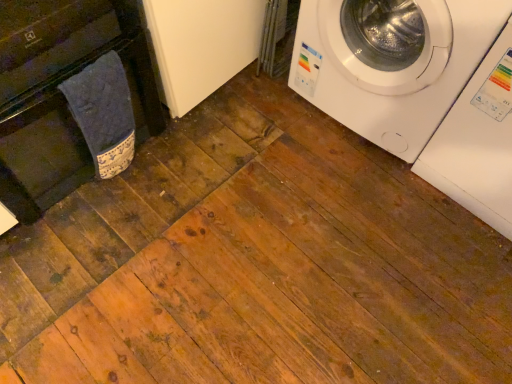
Question: Can you confirm if white glossy washing machine at upper right, the 1th washing machine viewed from the right, is taller than black matte dishwasher at left?

Choices:
 (A) no
 (B) yes

Answer: (A)

Question: Is white glossy washing machine at upper right, the 2th washing machine viewed from the left, shorter than black matte dishwasher at left?

Choices:
 (A) no
 (B) yes

Answer: (B)

Question: Considering the relative positions of white glossy washing machine at upper right, the 2th washing machine viewed from the left, and black matte dishwasher at left in the image provided, is white glossy washing machine at upper right, the 2th washing machine viewed from the left, to the left of black matte dishwasher at left from the viewer's perspective?

Choices:
 (A) no
 (B) yes

Answer: (A)

Question: Is black matte dishwasher at left at the back of white glossy washing machine at upper right, the 1th washing machine viewed from the right?

Choices:
 (A) no
 (B) yes

Answer: (A)

Question: Can you confirm if white glossy washing machine at upper right, the 2th washing machine viewed from the left, is smaller than black matte dishwasher at left?

Choices:
 (A) yes
 (B) no

Answer: (A)

Question: In terms of width, does black matte dishwasher at left look wider or thinner when compared to white glossy washing machine at upper right, which is the 2th washing machine in right-to-left order?

Choices:
 (A) thin
 (B) wide

Answer: (B)

Question: Which is correct: black matte dishwasher at left is inside white glossy washing machine at upper right, which is the 2th washing machine in right-to-left order, or outside of it?

Choices:
 (A) inside
 (B) outside

Answer: (B)

Question: In terms of size, does black matte dishwasher at left appear bigger or smaller than white glossy washing machine at upper right, acting as the 1th washing machine starting from the left?

Choices:
 (A) big
 (B) small

Answer: (A)

Question: From the image's perspective, relative to white glossy washing machine at upper right, which is the 2th washing machine in right-to-left order, is black matte dishwasher at left above or below?

Choices:
 (A) below
 (B) above

Answer: (A)

Question: Visually, is white glossy washing machine at upper right, the 2th washing machine viewed from the left, positioned to the left or to the right of blue fabric towel at left?

Choices:
 (A) left
 (B) right

Answer: (B)

Question: From the image's perspective, is white glossy washing machine at upper right, the 1th washing machine viewed from the right, located above or below blue fabric towel at left?

Choices:
 (A) above
 (B) below

Answer: (A)

Question: From a real-world perspective, relative to blue fabric towel at left, is white glossy washing machine at upper right, the 2th washing machine viewed from the left, vertically above or below?

Choices:
 (A) above
 (B) below

Answer: (A)

Question: Considering the positions of white glossy washing machine at upper right, the 1th washing machine viewed from the right, and blue fabric towel at left in the image, is white glossy washing machine at upper right, the 1th washing machine viewed from the right, bigger or smaller than blue fabric towel at left?

Choices:
 (A) big
 (B) small

Answer: (A)

Question: In the image, is black matte dishwasher at left on the left side or the right side of white glossy washing machine at upper right, the 1th washing machine viewed from the right?

Choices:
 (A) left
 (B) right

Answer: (A)

Question: From a real-world perspective, is black matte dishwasher at left above or below white glossy washing machine at upper right, the 2th washing machine viewed from the left?

Choices:
 (A) above
 (B) below

Answer: (A)